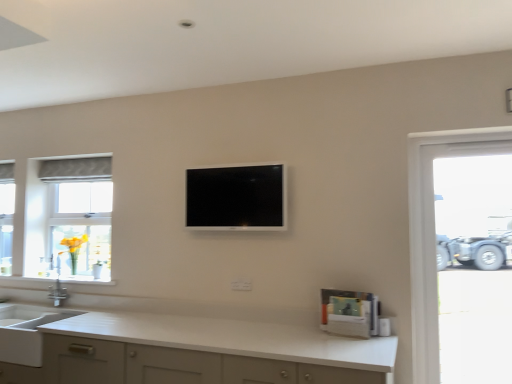
Question: Can you confirm if black glossy tv at center is bigger than matte gray fabric at left?

Choices:
 (A) no
 (B) yes

Answer: (A)

Question: Is black glossy tv at center shorter than matte gray fabric at left?

Choices:
 (A) yes
 (B) no

Answer: (A)

Question: Is black glossy tv at center with matte gray fabric at left?

Choices:
 (A) no
 (B) yes

Answer: (A)

Question: Considering the relative sizes of black glossy tv at center and matte gray fabric at left in the image provided, is black glossy tv at center smaller than matte gray fabric at left?

Choices:
 (A) yes
 (B) no

Answer: (A)

Question: Does black glossy tv at center have a greater width compared to matte gray fabric at left?

Choices:
 (A) yes
 (B) no

Answer: (B)

Question: From the image's perspective, would you say black glossy tv at center is positioned over matte gray fabric at left?

Choices:
 (A) no
 (B) yes

Answer: (B)

Question: Does yellow glass vase at left have a lesser height compared to white matte countertop at lower center?

Choices:
 (A) no
 (B) yes

Answer: (B)

Question: From the image's perspective, is yellow glass vase at left located beneath white matte countertop at lower center?

Choices:
 (A) no
 (B) yes

Answer: (A)

Question: Is yellow glass vase at left taller than white matte countertop at lower center?

Choices:
 (A) yes
 (B) no

Answer: (B)

Question: Is yellow glass vase at left thinner than white matte countertop at lower center?

Choices:
 (A) no
 (B) yes

Answer: (B)

Question: From a real-world perspective, is yellow glass vase at left below white matte countertop at lower center?

Choices:
 (A) no
 (B) yes

Answer: (A)

Question: From a real-world perspective, is yellow glass vase at left on top of white matte countertop at lower center?

Choices:
 (A) yes
 (B) no

Answer: (A)

Question: Is yellow glass vase at left at the left side of silver metallic faucet at left?

Choices:
 (A) no
 (B) yes

Answer: (A)